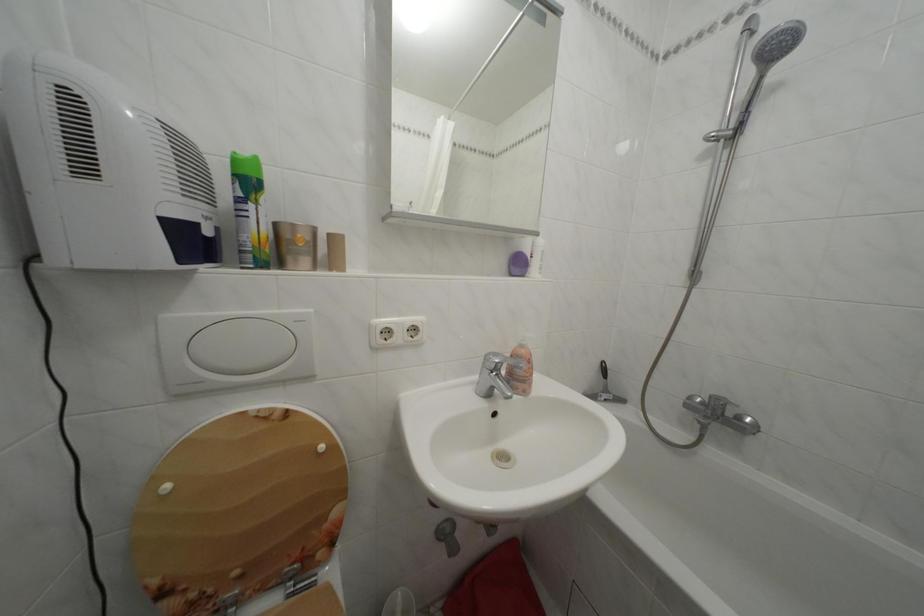
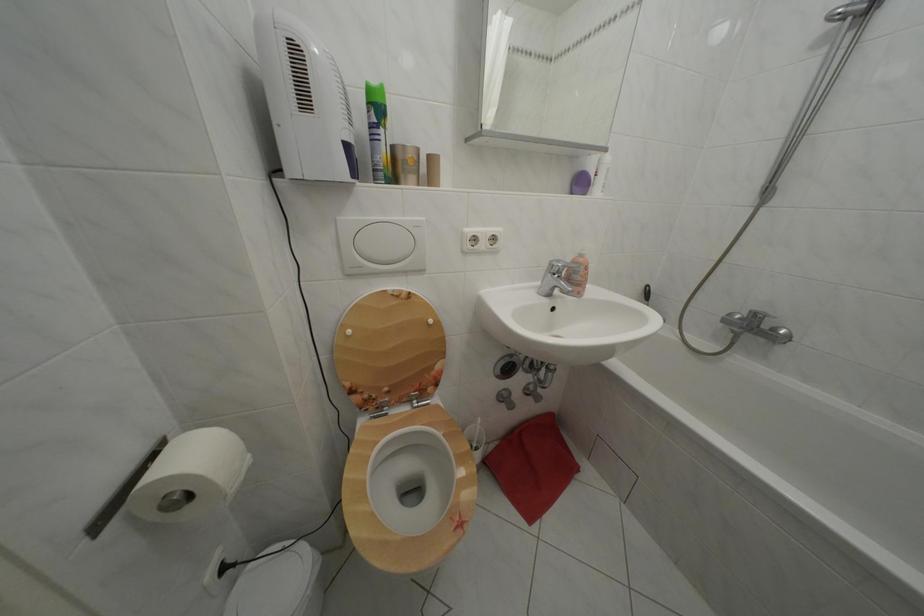
In the second image, find the point that corresponds to pixel 748 424 in the first image.

(783, 336)